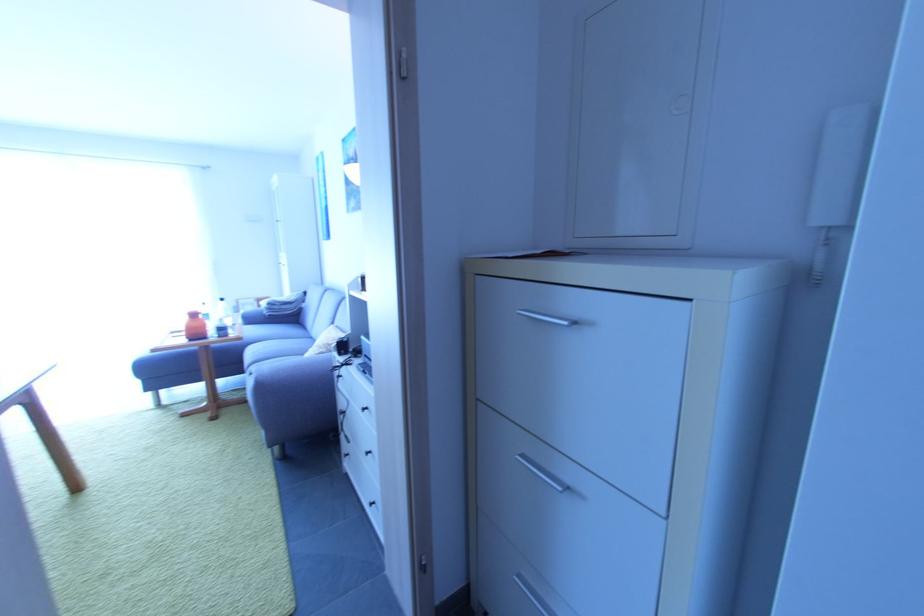
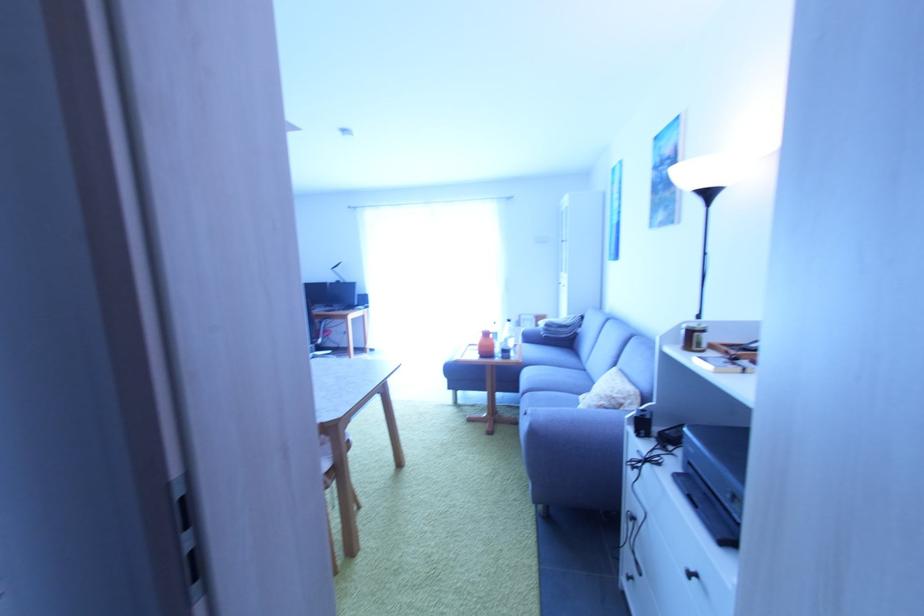
In the second image, find the point that corresponds to the point at 256,355 in the first image.

(530, 378)